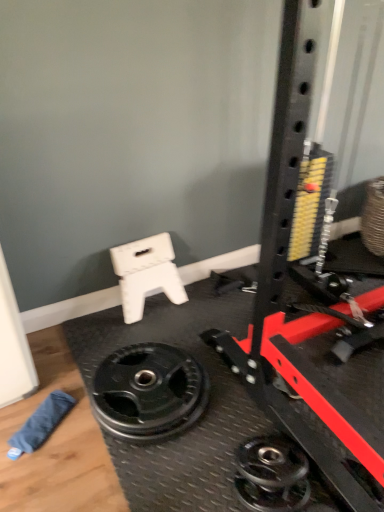
You are a GUI agent. You are given a task and a screenshot of the screen. Output one action in this format:
    pyautogui.click(x=<x>, y=<y>)
    Task: Click on the vacant space situated on the left part of black rubber weight plate at lower center
    This screenshot has width=384, height=512.
    Given the screenshot: What is the action you would take?
    pyautogui.click(x=46, y=395)